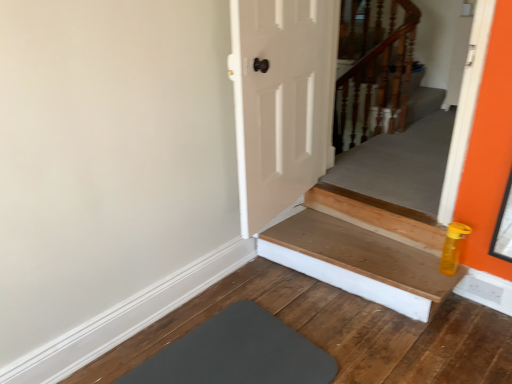
Image resolution: width=512 pixels, height=384 pixels. I want to click on gray rubber mat at lower left, so click(237, 353).

This screenshot has width=512, height=384. Identify the location of wooden at bottom. (364, 249).

At what (x,y) coordinates should I click in order to perform the action: click on gray rubber mat at lower left. Please return your answer as a coordinate pair (x, y). Looking at the image, I should click on (237, 353).

Visually, is wooden at upper right positioned to the left or to the right of gray rubber mat at lower left?

In the image, wooden at upper right appears on the right side of gray rubber mat at lower left.

From their relative heights in the image, would you say wooden at upper right is taller or shorter than gray rubber mat at lower left?

Clearly, wooden at upper right is taller compared to gray rubber mat at lower left.

Can you confirm if wooden at upper right is bigger than gray rubber mat at lower left?

Yes, wooden at upper right is bigger than gray rubber mat at lower left.

Where is `rail above the wooden at bottom (from the image's perspective)`? This screenshot has height=384, width=512. rail above the wooden at bottom (from the image's perspective) is located at coordinates (374, 69).

In the scene shown: Is the depth of wooden at bottom less than that of wooden at upper right?

Yes, wooden at bottom is in front of wooden at upper right.

Do you think wooden at bottom is within wooden at upper right, or outside of it?

The correct answer is: outside.

How far apart are wooden at bottom and wooden at upper right?

wooden at bottom is 1.52 meters away from wooden at upper right.

From the image's perspective, is wooden at upper right beneath wooden at bottom?

No, from the image's perspective, wooden at upper right is not beneath wooden at bottom.

Looking at the image, does wooden at upper right seem bigger or smaller compared to wooden at bottom?

In the image, wooden at upper right appears to be larger than wooden at bottom.

Does wooden at bottom lie in front of gray rubber mat at lower left?

No, it is not.

Does point (318, 216) appear closer or farther from the camera than point (223, 351)?

Point (318, 216).

Is wooden at bottom oriented towards gray rubber mat at lower left?

Yes, wooden at bottom is turned towards gray rubber mat at lower left.

You are a GUI agent. You are given a task and a screenshot of the screen. Output one action in this format:
    pyautogui.click(x=<x>, y=<y>)
    Task: Click on the stairs on the right of the gray rubber mat at lower left
    The width and height of the screenshot is (512, 384).
    Given the screenshot: What is the action you would take?
    pyautogui.click(x=364, y=249)

Is gray rubber mat at lower left in front of wooden at bottom?

Yes.

Does gray rubber mat at lower left have a lesser width compared to wooden at bottom?

In fact, gray rubber mat at lower left might be wider than wooden at bottom.

The image size is (512, 384). I want to click on mat below the wooden at bottom (from a real-world perspective), so click(237, 353).

Considering the positions of points (267, 354) and (369, 197), is point (267, 354) closer to camera compared to point (369, 197)?

Yes, it is.

From the picture: From the image's perspective, is gray rubber mat at lower left located above or below wooden at upper right?

From the image's perspective, gray rubber mat at lower left appears below wooden at upper right.

Are gray rubber mat at lower left and wooden at upper right far apart?

gray rubber mat at lower left is far away from wooden at upper right.

From a real-world perspective, who is located lower, gray rubber mat at lower left or wooden at upper right?

gray rubber mat at lower left, from a real-world perspective.

Locate an element on the screen. The image size is (512, 384). mat beneath the wooden at upper right (from a real-world perspective) is located at coordinates (x=237, y=353).

Identify the location of rail behind the wooden at bottom. Image resolution: width=512 pixels, height=384 pixels. (374, 69).

Based on their spatial positions, is wooden at upper right or gray rubber mat at lower left closer to wooden at bottom?

gray rubber mat at lower left is closer to wooden at bottom.

From the image, which object appears to be farther from gray rubber mat at lower left, wooden at bottom or wooden at upper right?

Based on the image, wooden at upper right appears to be further to gray rubber mat at lower left.

Estimate the real-world distances between objects in this image. Which object is further from wooden at upper right, gray rubber mat at lower left or wooden at bottom?

gray rubber mat at lower left is further to wooden at upper right.

Which object lies further to the anchor point wooden at bottom, gray rubber mat at lower left or wooden at upper right?

wooden at upper right is positioned further to the anchor wooden at bottom.

Which object lies further to the anchor point gray rubber mat at lower left, wooden at upper right or wooden at bottom?

wooden at upper right is further to gray rubber mat at lower left.

From the image, which object appears to be nearer to wooden at upper right, wooden at bottom or gray rubber mat at lower left?

wooden at bottom.

Where is `stairs between wooden at upper right and gray rubber mat at lower left from top to bottom`? The width and height of the screenshot is (512, 384). stairs between wooden at upper right and gray rubber mat at lower left from top to bottom is located at coordinates (364, 249).